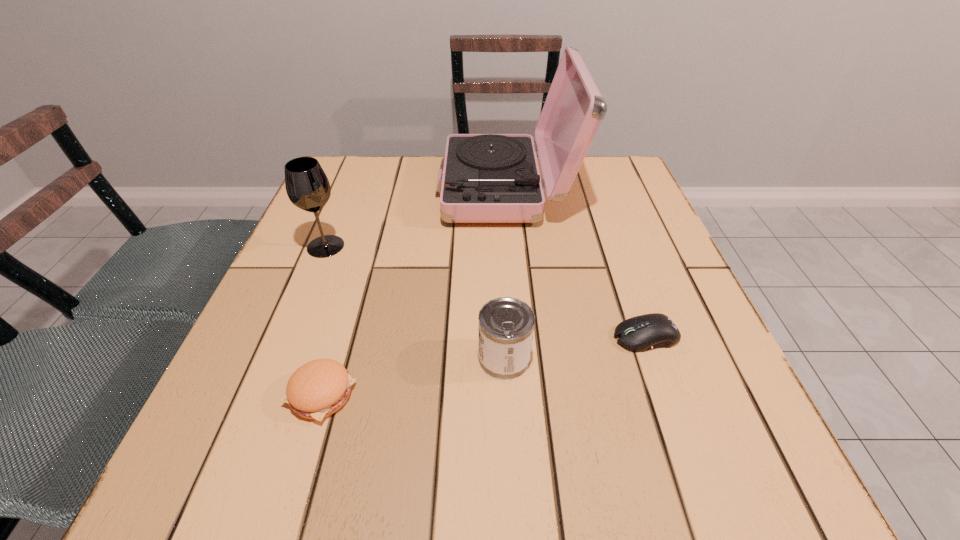
Locate an element on the screen. The width and height of the screenshot is (960, 540). vacant area situated 0.180m on the right of the can is located at coordinates (636, 358).

Find the location of a particular element. The width and height of the screenshot is (960, 540). free space located on the right of the fourth tallest object is located at coordinates (588, 395).

Where is `vacant region located on the left of the computer equipment`? vacant region located on the left of the computer equipment is located at coordinates (434, 336).

Locate an element on the screen. The image size is (960, 540). object at the far edge is located at coordinates (487, 178).

In order to click on wineglass that is at the left edge in this screenshot , I will do `click(307, 186)`.

Locate an element on the screen. patty that is positioned at the left edge is located at coordinates (319, 388).

This screenshot has height=540, width=960. Identify the location of object located at the right edge. (641, 333).

The width and height of the screenshot is (960, 540). I want to click on vacant space at the far edge of the desktop, so click(413, 161).

This screenshot has height=540, width=960. In the image, there is a desktop. In order to click on vacant space at the left edge in this screenshot , I will do `click(275, 288)`.

Identify the location of vacant area at the right edge of the desktop. Image resolution: width=960 pixels, height=540 pixels. (652, 370).